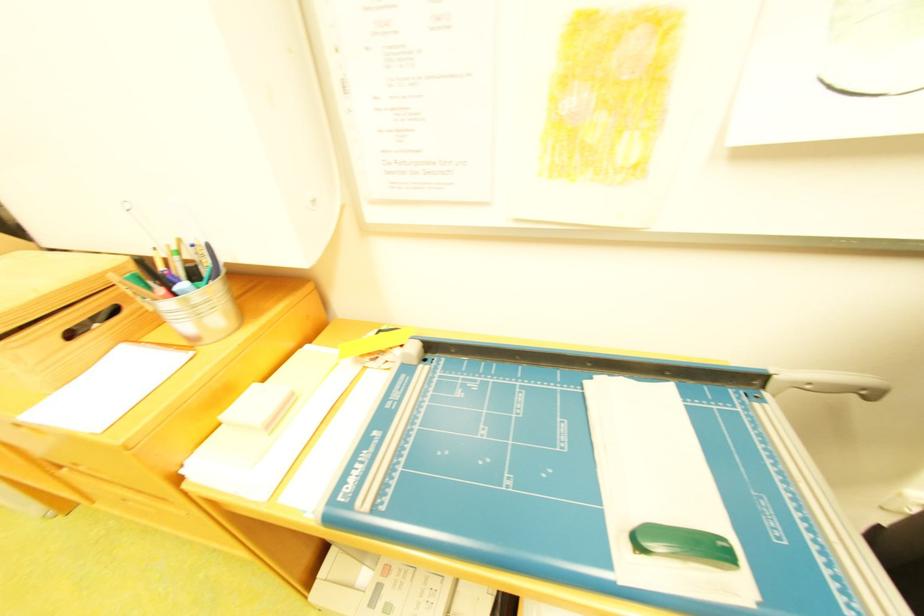
Find where to pull the drawer handle. Please return your answer as a coordinate pair (x, y).

(78, 329)